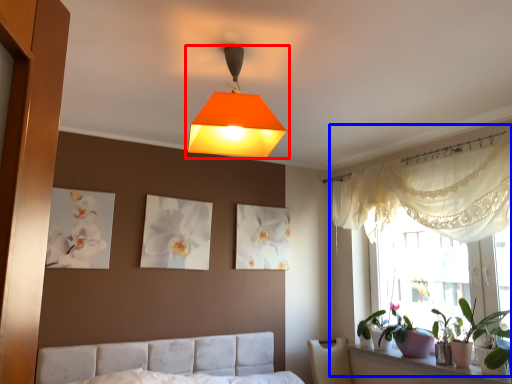
Question: Which of the following is the closest to the observer, lamp (highlighted by a red box) or bay window (highlighted by a blue box)?

Choices:
 (A) lamp
 (B) bay window

Answer: (A)